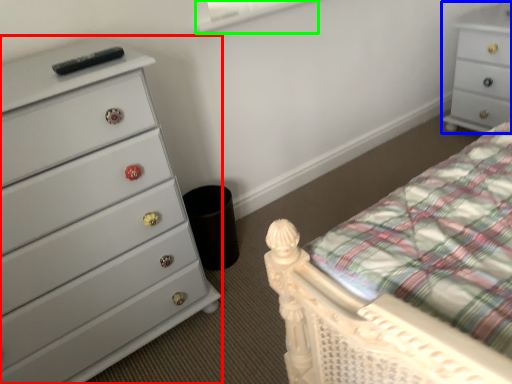
Question: Considering the real-world distances, which object is closest to chest of drawers (highlighted by a red box)? chest of drawers (highlighted by a blue box) or window screen (highlighted by a green box).

Choices:
 (A) chest of drawers
 (B) window screen

Answer: (B)